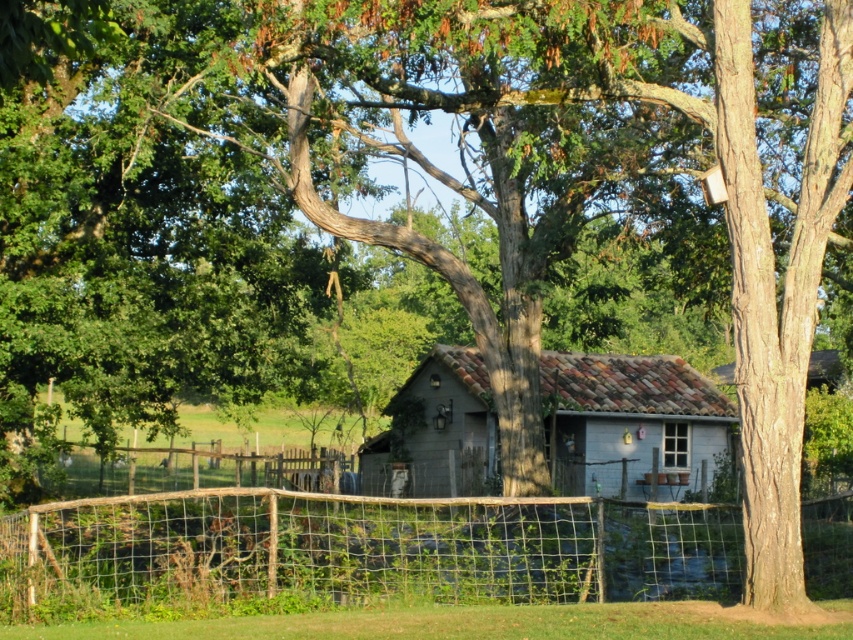
You are standing at the point with coordinates point (x=723, y=516) and want to walk towards the point with coordinates point (x=498, y=451). Given that there is a wire fence in the foreground, will you have to go around it or can you walk straight through?

Since point (x=723, y=516) is in front of point (x=498, y=451), you can walk straight through without needing to go around the wire fence.

You are a landscape architect designing a pathway that needs to pass between the rustic wire mesh fence at lower center and the gray wood cabin at center. Based on the scene description, which object has a greater width and should be considered for pathway planning?

The rustic wire mesh fence at lower center has a greater width than the gray wood cabin at center, so it should be considered for pathway planning.

You are a visitor approaching the gray wood cabin at center and notice the rustic wire mesh fence at lower center. From your perspective, is the fence located in front of or behind the cabin?

The rustic wire mesh fence at lower center is positioned under gray wood cabin at center, meaning it is located in front of the cabin from your perspective.